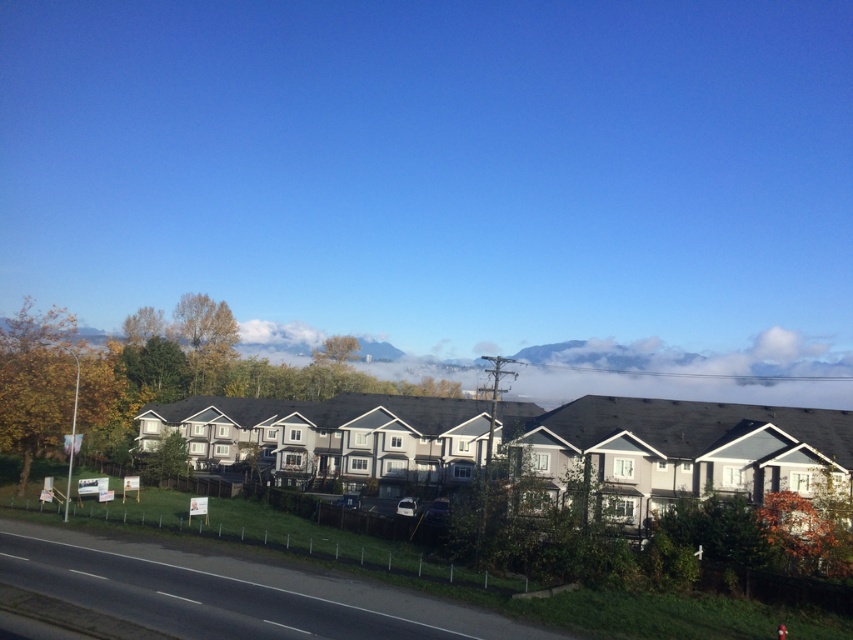
Looking at this image, who is positioned more to the left, black asphalt road at lower left or green grass at lower left?

black asphalt road at lower left

Is point (97, 588) farther from viewer compared to point (235, 506)?

That is False.

This screenshot has height=640, width=853. What do you see at coordinates (198, 595) in the screenshot? I see `black asphalt road at lower left` at bounding box center [198, 595].

Where is `black asphalt road at lower left`? The height and width of the screenshot is (640, 853). black asphalt road at lower left is located at coordinates (198, 595).